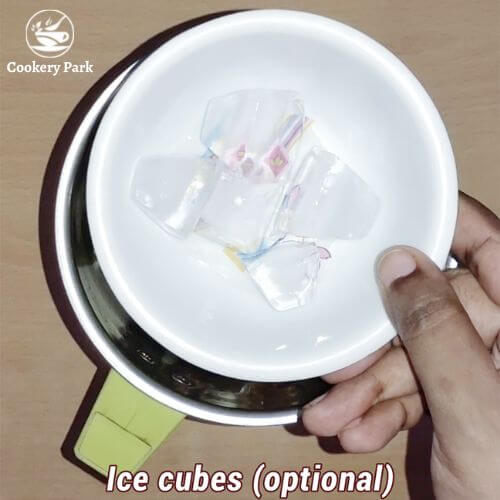
This screenshot has width=500, height=500. What are the coordinates of `cup` in the screenshot? It's located at click(156, 383).